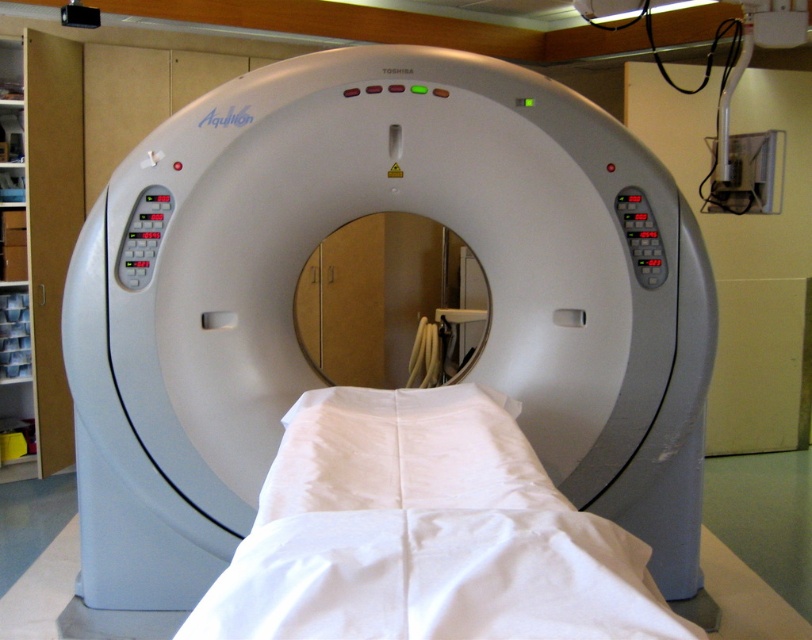
Is white fabric bed at center wider than white smooth pillow at center?

Indeed, white fabric bed at center has a greater width compared to white smooth pillow at center.

Which is more to the left, white fabric bed at center or white smooth pillow at center?

white smooth pillow at center

Does point (400, 632) come in front of point (290, 513)?

Yes, point (400, 632) is closer to viewer.

You are a GUI agent. You are given a task and a screenshot of the screen. Output one action in this format:
    pyautogui.click(x=<x>, y=<y>)
    Task: Click on the white fabric bed at center
    This screenshot has height=640, width=812.
    Given the screenshot: What is the action you would take?
    pyautogui.click(x=425, y=532)